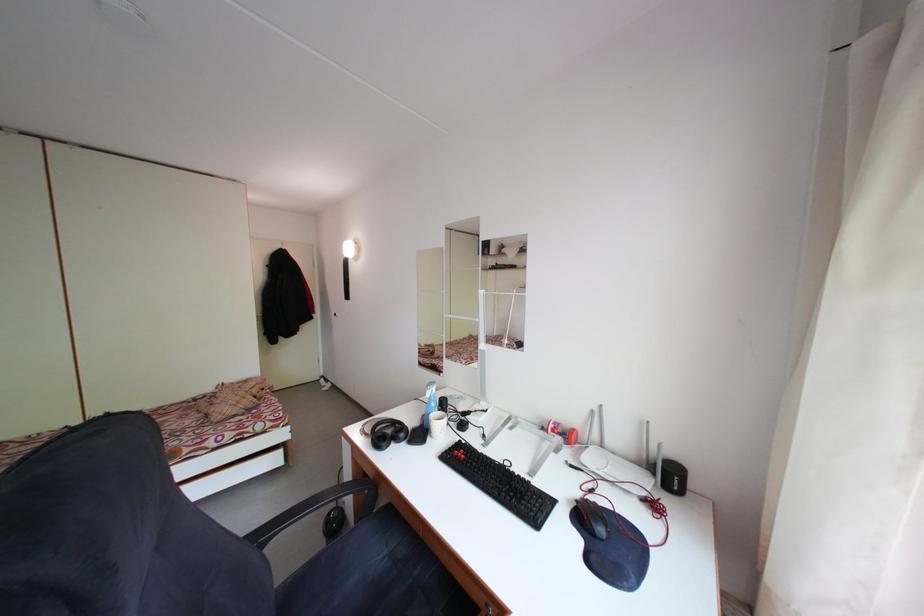
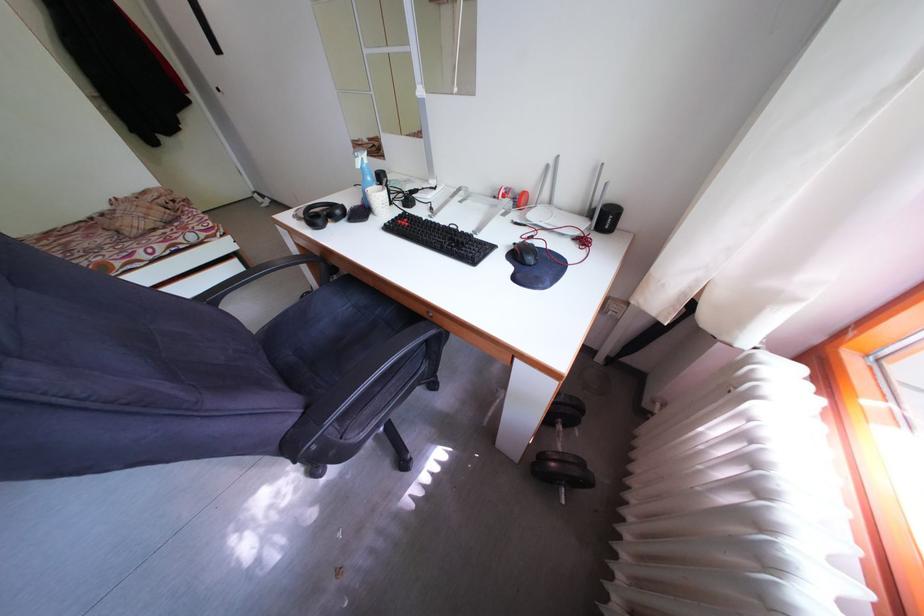
Find the pixel in the second image that matches (x=282, y=467) in the first image.

(241, 276)